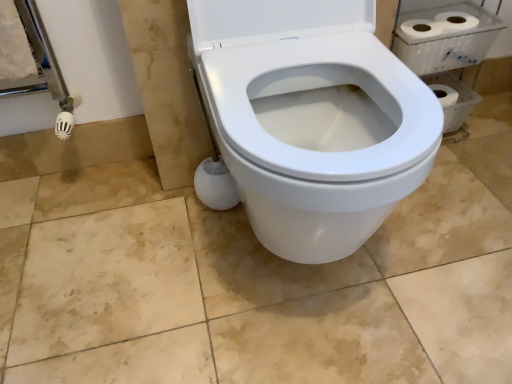
The width and height of the screenshot is (512, 384). In order to click on vacant space to the right of white glossy toilet at center in this screenshot , I will do `click(451, 241)`.